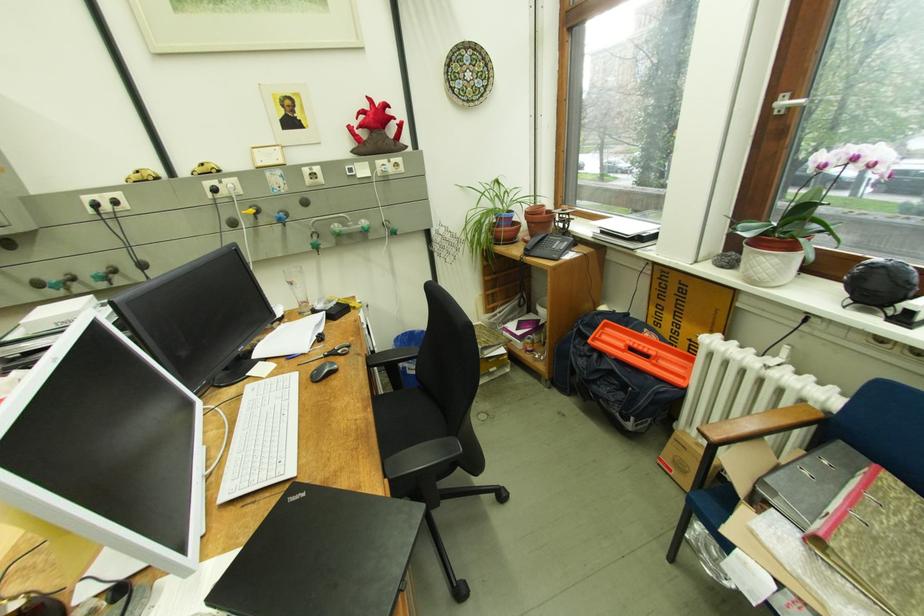
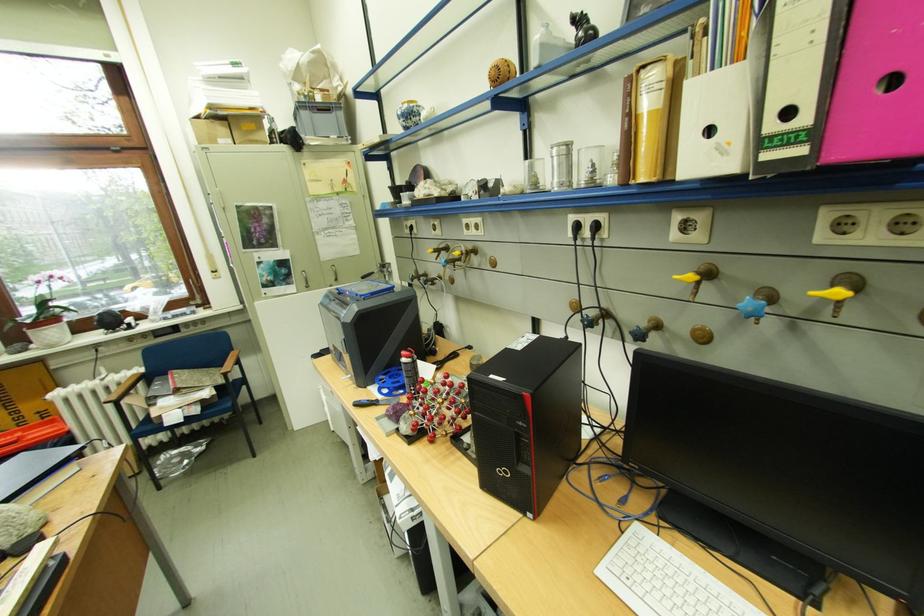
The point at (829, 544) is marked in the first image. Where is the corresponding point in the second image?

(187, 392)